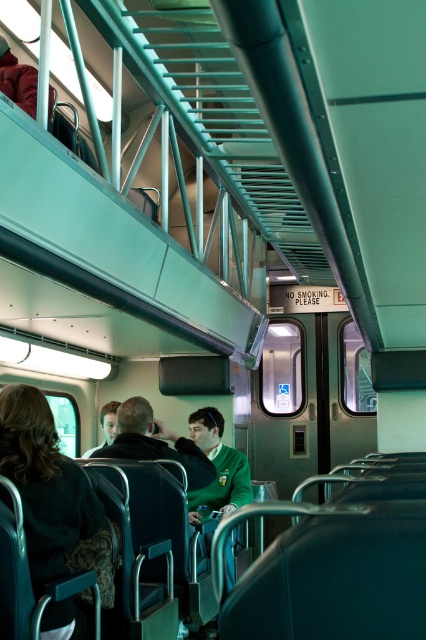
Can you confirm if dark green sweater at lower left is taller than green fabric jacket at center?

Yes.

Is dark green sweater at lower left closer to the viewer compared to green fabric jacket at center?

Yes, it is.

The image size is (426, 640). I want to click on dark green sweater at lower left, so click(x=48, y=490).